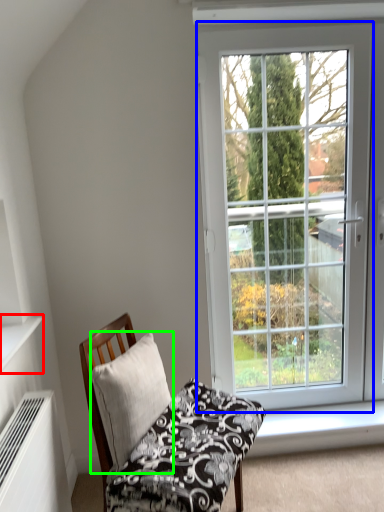
Question: Considering the real-world distances, which object is closest to shelf (highlighted by a red box)? window (highlighted by a blue box) or pillow (highlighted by a green box).

Choices:
 (A) window
 (B) pillow

Answer: (B)